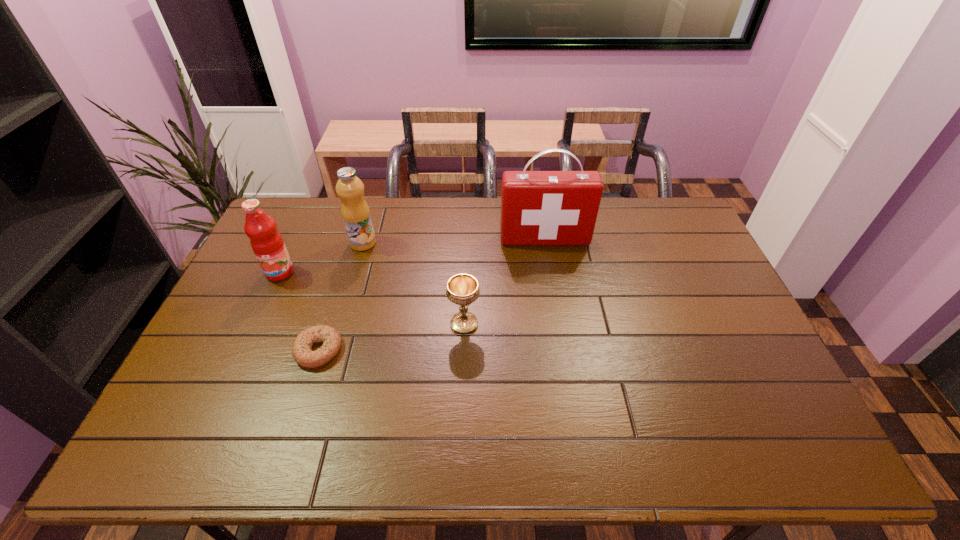
At what (x,y) coordinates should I click in order to perform the action: click on vacant space at the far left corner of the desktop. Please return your answer as a coordinate pair (x, y). Looking at the image, I should click on (319, 212).

Find the location of `vacant space at the near left corner of the desktop`. vacant space at the near left corner of the desktop is located at coordinates (177, 442).

Identify the location of vacant space that's between the farther fruit juice and the rightmost object. This screenshot has width=960, height=540. (454, 241).

The image size is (960, 540). What are the coordinates of `vacant space in between the chalice and the tallest object` in the screenshot? It's located at click(x=504, y=281).

Find the location of a particular element. The width and height of the screenshot is (960, 540). vacant area that lies between the right fruit juice and the bagel is located at coordinates (341, 296).

Locate an element on the screen. This screenshot has width=960, height=540. free space that is in between the left fruit juice and the chalice is located at coordinates (372, 298).

This screenshot has height=540, width=960. In order to click on free space between the chalice and the third farthest object in this screenshot , I will do `click(372, 298)`.

The image size is (960, 540). Identify the location of vacant area that lies between the chalice and the right fruit juice. (414, 284).

Identify the location of vacant space in between the left fruit juice and the first-aid kit. (412, 256).

Identify the location of empty space between the third farthest object and the right fruit juice. This screenshot has width=960, height=540. (322, 258).